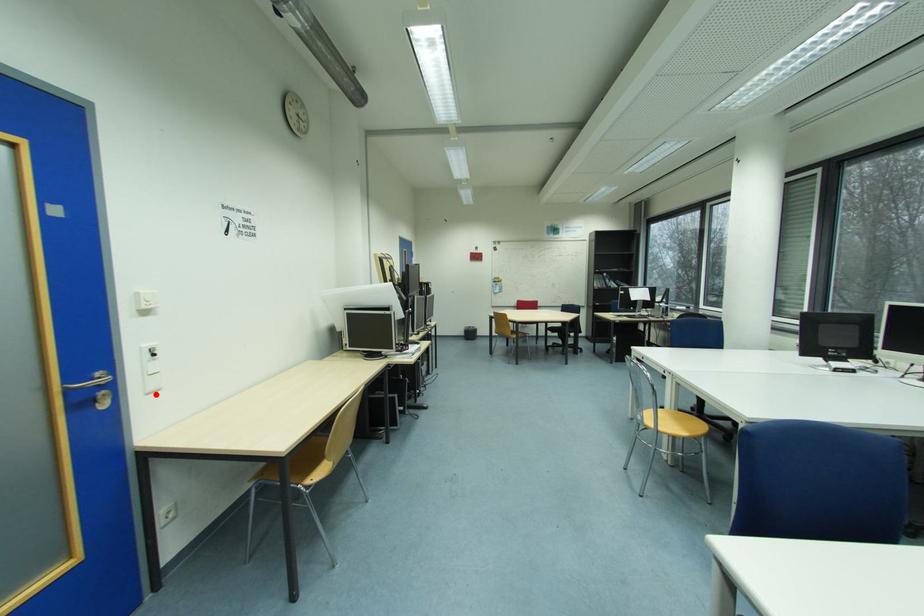
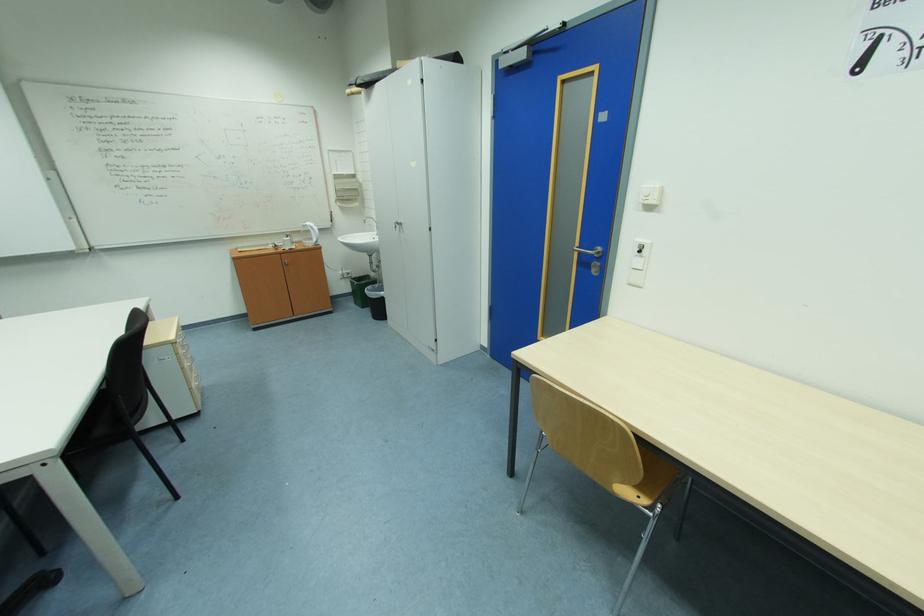
The point at the highlighted location is marked in the first image. Where is the corresponding point in the second image?

(638, 286)